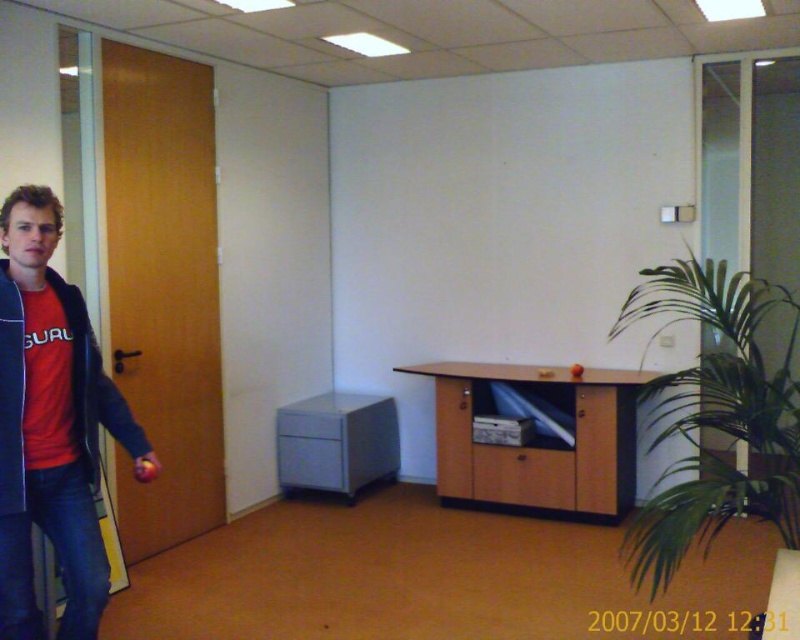
Question: Where is red cotton shirt at left located in relation to satin gray cabinet at center in the image?

Choices:
 (A) left
 (B) right

Answer: (A)

Question: Considering the relative positions of wooden cabinet at lower right and satin gray cabinet at center in the image provided, where is wooden cabinet at lower right located with respect to satin gray cabinet at center?

Choices:
 (A) right
 (B) left

Answer: (A)

Question: Is red cotton shirt at left above satin gray cabinet at center?

Choices:
 (A) yes
 (B) no

Answer: (A)

Question: Which object is the farthest from the wooden cabinet at lower right?

Choices:
 (A) red cotton shirt at left
 (B) satin gray cabinet at center

Answer: (A)

Question: Which of the following is the farthest from the observer?

Choices:
 (A) (370, 444)
 (B) (18, 568)

Answer: (A)

Question: Which point is farther from the camera taking this photo?

Choices:
 (A) (22, 563)
 (B) (454, 385)

Answer: (B)